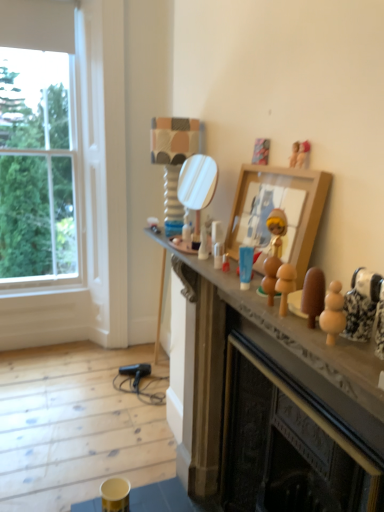
Question: Is clear glass window at left at the left side of wooden toy at center, the fourth toy viewed from the right?

Choices:
 (A) yes
 (B) no

Answer: (A)

Question: Is clear glass window at left thinner than wooden toy at center, placed as the 4th toy when sorted from top to bottom?

Choices:
 (A) yes
 (B) no

Answer: (B)

Question: Is clear glass window at left touching wooden toy at center, the fourth toy viewed from the right?

Choices:
 (A) no
 (B) yes

Answer: (A)

Question: Considering the relative sizes of clear glass window at left and wooden toy at center, the fourth toy viewed from the right, in the image provided, is clear glass window at left taller than wooden toy at center, the fourth toy viewed from the right,?

Choices:
 (A) yes
 (B) no

Answer: (A)

Question: From the image's perspective, is clear glass window at left on wooden toy at center, the second toy ordered from the bottom?

Choices:
 (A) yes
 (B) no

Answer: (A)

Question: In terms of size, does wooden doll at upper right, which is the third toy in front-to-back order, appear bigger or smaller than wooden picture frame at upper center?

Choices:
 (A) big
 (B) small

Answer: (B)

Question: Would you say wooden doll at upper right, the fourth toy positioned from the left, is inside or outside wooden picture frame at upper center?

Choices:
 (A) inside
 (B) outside

Answer: (A)

Question: Visually, is wooden doll at upper right, the second toy when ordered from top to bottom, positioned to the left or to the right of wooden picture frame at upper center?

Choices:
 (A) right
 (B) left

Answer: (A)

Question: Is wooden doll at upper right, the fourth toy positioned from the left, taller or shorter than wooden picture frame at upper center?

Choices:
 (A) short
 (B) tall

Answer: (A)

Question: In terms of size, does wooden figurine at upper center, the fourth toy when ordered from front to back, appear bigger or smaller than clear glass window at left?

Choices:
 (A) big
 (B) small

Answer: (B)

Question: Is wooden figurine at upper center, the 5th toy when ordered from bottom to top, to the left or to the right of clear glass window at left in the image?

Choices:
 (A) right
 (B) left

Answer: (A)

Question: From the image's perspective, relative to clear glass window at left, is wooden figurine at upper center, the fourth toy when ordered from front to back, above or below?

Choices:
 (A) below
 (B) above

Answer: (A)

Question: Is wooden figurine at upper center, which appears as the 3th toy when viewed from the left, wider or thinner than clear glass window at left?

Choices:
 (A) wide
 (B) thin

Answer: (B)

Question: From a real-world perspective, is wooden picture frame at upper center positioned above or below porcelain figurine at right, marked as the first toy in a bottom-to-top arrangement?

Choices:
 (A) above
 (B) below

Answer: (A)

Question: Is wooden picture frame at upper center in front of or behind porcelain figurine at right, which is the 5th toy in back-to-front order, in the image?

Choices:
 (A) front
 (B) behind

Answer: (B)